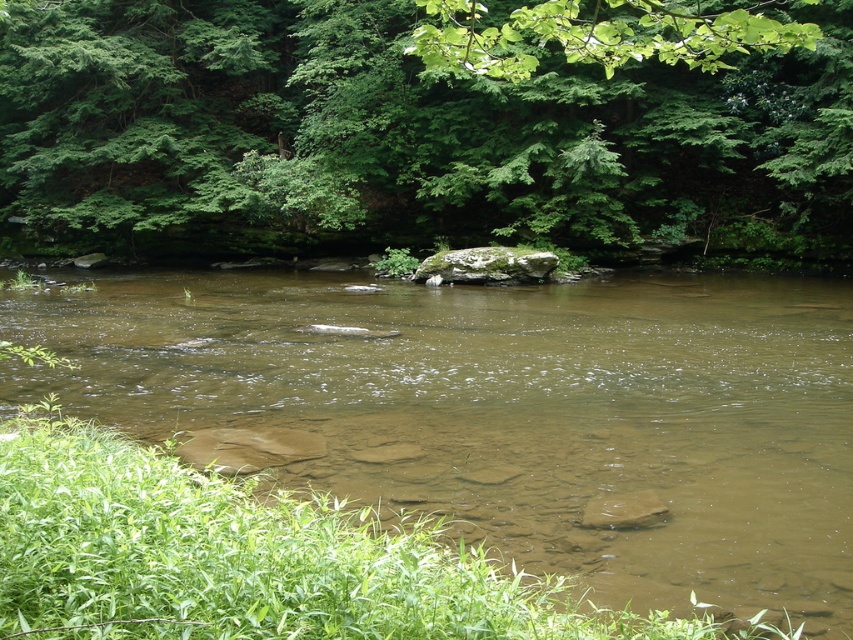
Can you confirm if green leafy tree at upper center is positioned to the left of brown/muddy water at center?

Indeed, green leafy tree at upper center is positioned on the left side of brown/muddy water at center.

Is green leafy tree at upper center above brown/muddy water at center?

Yes.

Is point (196, 164) positioned behind point (804, 605)?

Yes, it is.

This screenshot has width=853, height=640. I want to click on green leafy tree at upper center, so click(426, 124).